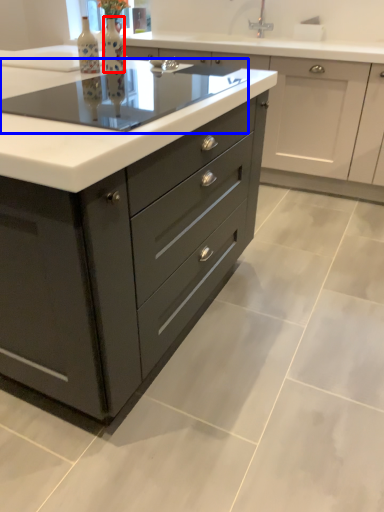
Question: Which object is further to the camera taking this photo, bottle (highlighted by a red box) or appliance (highlighted by a blue box)?

Choices:
 (A) bottle
 (B) appliance

Answer: (A)